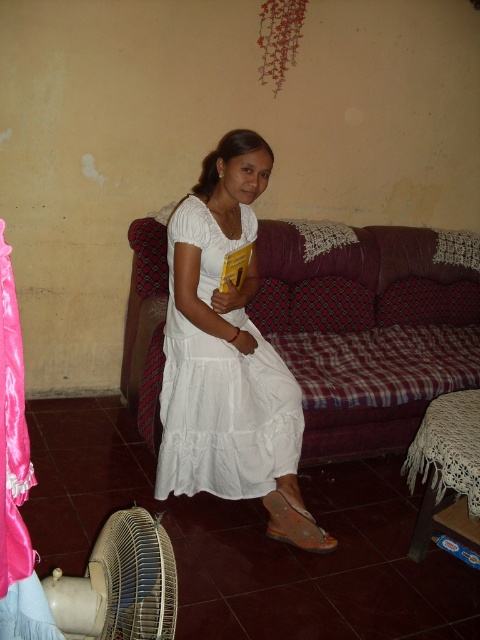
You are standing in front of the sofa and want to place a small plant between the two points marked as point (204, 467) and point (302, 531). Which point should the plant be closer to so that it appears closer to you?

The plant should be placed closer to point (204, 467) because it is further to the camera than point (302, 531), making it appear closer to you.

You are standing in the room and want to reach the brown leather sandal at lower center to pick it up. Is the beige plastic fan at lower left blocking your path to it?

The beige plastic fan at lower left is in front of brown leather sandal at lower center, so the fan is blocking the path to the sandal. You would need to move the fan first to access the sandal.

You are a photographer standing at a distance from the white cotton dress at center. You want to take a closeup shot of the dress without moving the camera. What should you do?

Since the white cotton dress at center is 2.15 meters away from the camera, you can use a zoom lens to get a closeup shot without moving the camera.